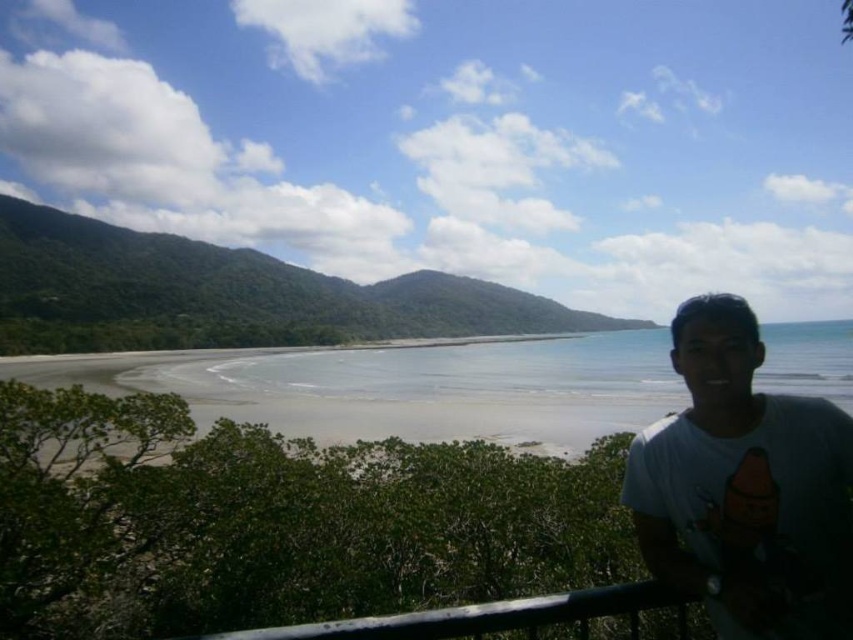
You are a photographer positioned at the railing and want to capture both the point at coordinates point [801,472] and point [368,624] in your shot. Which point will appear closer to the camera in the photo?

Point [801,472] is further to the viewer than point [368,624], so in the photo, point [801,472] will appear closer to the camera than point [368,624].